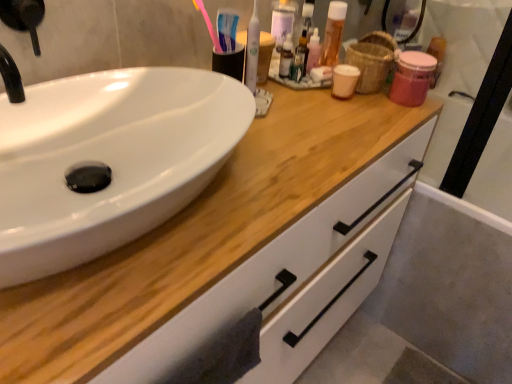
In order to click on free point in front of white plastic toothbrush at upper center, which ranks as the second mouthwash in back-to-front order in this screenshot , I will do `click(281, 138)`.